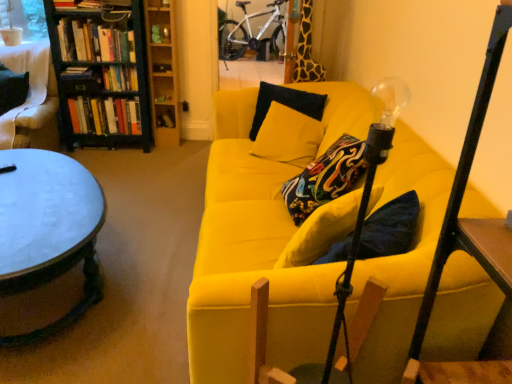
Locate an element on the screen. vacant space in front of black wood bookcase at left, which is the second bookcase from right to left is located at coordinates (123, 165).